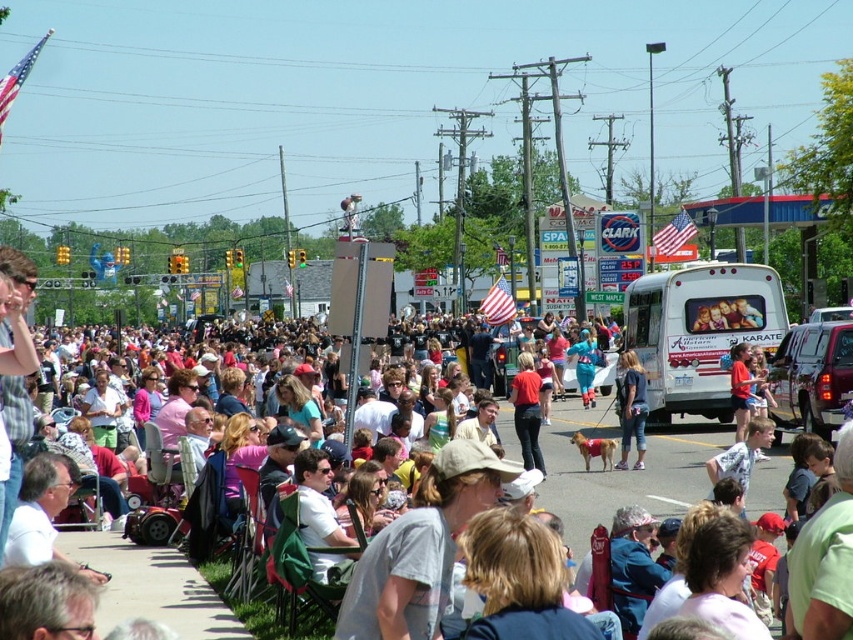
Where is `red fabric dog at center`? This screenshot has width=853, height=640. red fabric dog at center is located at coordinates (x=622, y=472).

Does red fabric dog at center have a lesser width compared to light brown dog at center?

No.

Measure the distance between point (x=567, y=448) and camera.

The distance of point (x=567, y=448) from camera is 29.20 meters.

Where is `red fabric dog at center`? Image resolution: width=853 pixels, height=640 pixels. red fabric dog at center is located at coordinates (622, 472).

Does light brown dog at center have a smaller size compared to matte red shirt at center?

Indeed, light brown dog at center has a smaller size compared to matte red shirt at center.

Image resolution: width=853 pixels, height=640 pixels. Find the location of `light brown dog at center`. light brown dog at center is located at coordinates (631, 408).

Consider the image. Can you confirm if white matte van at center is positioned below red cotton shirt at center?

Incorrect, white matte van at center is not positioned below red cotton shirt at center.

Is white matte van at center thinner than red cotton shirt at center?

Incorrect, white matte van at center's width is not less than red cotton shirt at center's.

You are a GUI agent. You are given a task and a screenshot of the screen. Output one action in this format:
    pyautogui.click(x=<x>, y=<y>)
    Task: Click on the white matte van at center
    This screenshot has height=640, width=853.
    Given the screenshot: What is the action you would take?
    pyautogui.click(x=699, y=332)